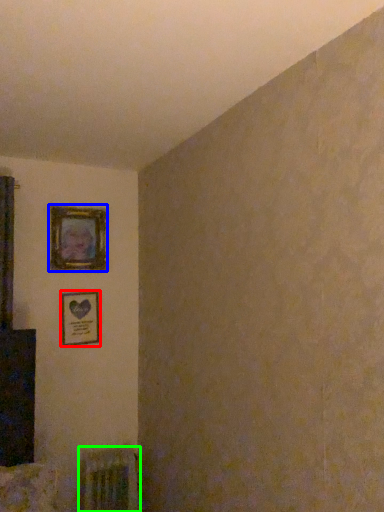
Question: Considering the real-world distances, which object is closest to picture frame (highlighted by a red box)? picture frame (highlighted by a blue box) or radiator (highlighted by a green box).

Choices:
 (A) picture frame
 (B) radiator

Answer: (A)